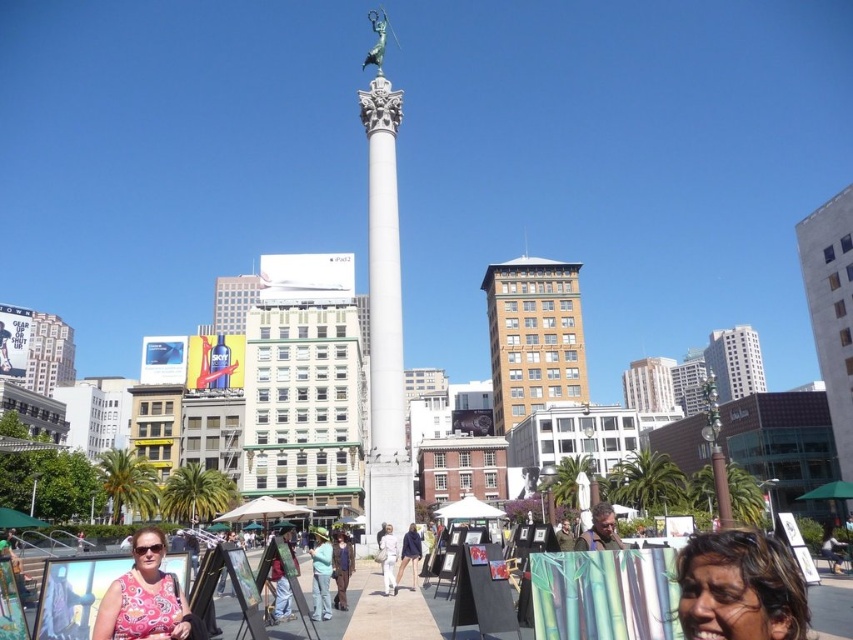
Question: Which point appears closest to the camera in this image?

Choices:
 (A) (607, 548)
 (B) (785, 616)
 (C) (122, 592)

Answer: (B)

Question: Which of the following is the closest to the observer?

Choices:
 (A) matte brown jacket at lower right
 (B) light blue denim jeans at center

Answer: (A)

Question: Is pink fabric at lower left positioned in front of blue denim jacket at lower center?

Choices:
 (A) yes
 (B) no

Answer: (A)

Question: Does denim pants at center lie behind white cotton pants at center?

Choices:
 (A) yes
 (B) no

Answer: (B)

Question: Which of the following is the closest to the observer?

Choices:
 (A) polished bronze statue at center
 (B) matte brown jacket at lower right

Answer: (B)

Question: From the image, what is the correct spatial relationship of denim pants at center in relation to blue denim jacket at lower center?

Choices:
 (A) above
 (B) below

Answer: (B)